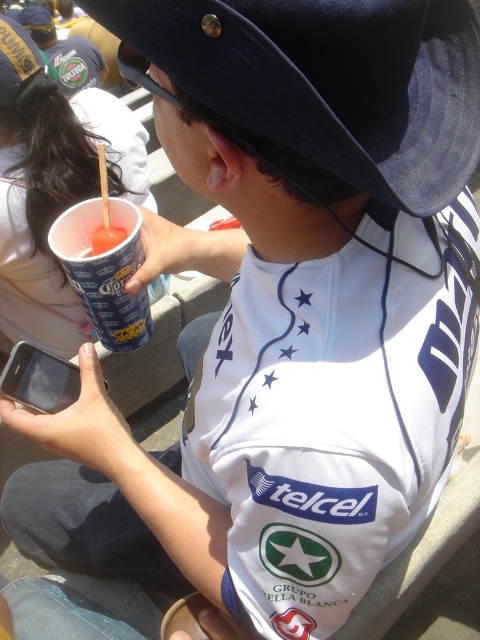
Which is more to the right, black felt baseball hat at upper center or blue paper cup at lower left?

black felt baseball hat at upper center

Does black felt baseball hat at upper center have a greater width compared to blue paper cup at lower left?

Yes.

Does point (288, 49) come farther from viewer compared to point (113, 307)?

No.

Where is `black felt baseball hat at upper center`? black felt baseball hat at upper center is located at coordinates (328, 81).